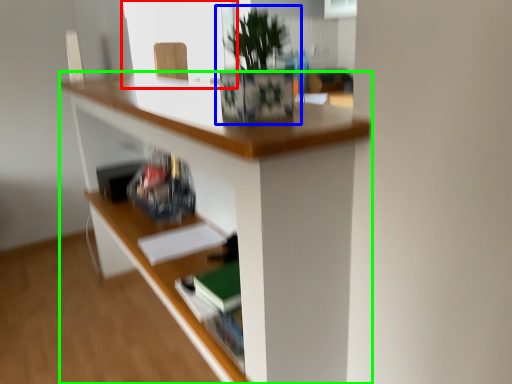
Question: Which object is positioned closest to window screen (highlighted by a red box)? Select from houseplant (highlighted by a blue box) and desk (highlighted by a green box).

Choices:
 (A) houseplant
 (B) desk

Answer: (B)